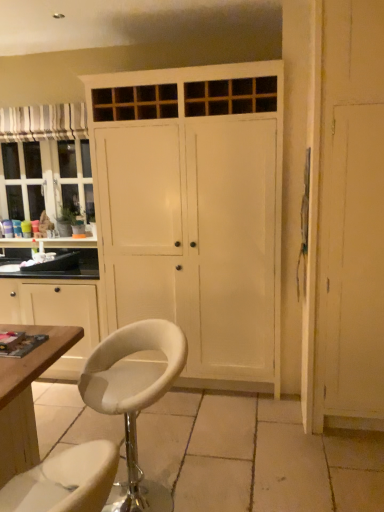
Find the location of a particular element. The height and width of the screenshot is (512, 384). vacant space in between white leather stool at center and wooden screen door at right is located at coordinates (258, 453).